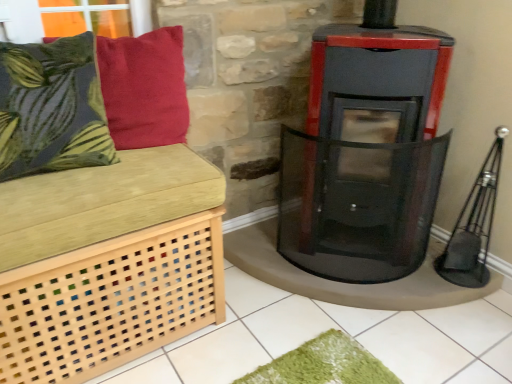
Question: Considering the relative positions of light wood lattice bench at left and green leafy fabric cushion at left, acting as the first pillow starting from the left, in the image provided, is light wood lattice bench at left to the left of green leafy fabric cushion at left, acting as the first pillow starting from the left, from the viewer's perspective?

Choices:
 (A) yes
 (B) no

Answer: (B)

Question: Is light wood lattice bench at left at the right side of green leafy fabric cushion at left, acting as the first pillow starting from the left?

Choices:
 (A) no
 (B) yes

Answer: (B)

Question: Is light wood lattice bench at left further to camera compared to green leafy fabric cushion at left, the 2th pillow viewed from the right?

Choices:
 (A) no
 (B) yes

Answer: (A)

Question: Is light wood lattice bench at left aimed at green leafy fabric cushion at left, the 2th pillow viewed from the right?

Choices:
 (A) yes
 (B) no

Answer: (B)

Question: From a real-world perspective, is light wood lattice bench at left positioned over green leafy fabric cushion at left, the 2th pillow viewed from the right, based on gravity?

Choices:
 (A) yes
 (B) no

Answer: (B)

Question: Considering the relative sizes of light wood lattice bench at left and green leafy fabric cushion at left, the 2th pillow viewed from the right, in the image provided, is light wood lattice bench at left bigger than green leafy fabric cushion at left, the 2th pillow viewed from the right,?

Choices:
 (A) no
 (B) yes

Answer: (B)

Question: Is black glass wood burning stove at center located outside light wood lattice bench at left?

Choices:
 (A) no
 (B) yes

Answer: (B)

Question: Is black glass wood burning stove at center not near light wood lattice bench at left?

Choices:
 (A) no
 (B) yes

Answer: (A)

Question: From a real-world perspective, is black glass wood burning stove at center below light wood lattice bench at left?

Choices:
 (A) no
 (B) yes

Answer: (A)

Question: From the image's perspective, is black glass wood burning stove at center on top of light wood lattice bench at left?

Choices:
 (A) yes
 (B) no

Answer: (A)

Question: Is light wood lattice bench at left at the back of black glass wood burning stove at center?

Choices:
 (A) no
 (B) yes

Answer: (A)

Question: Can you confirm if black glass wood burning stove at center is shorter than light wood lattice bench at left?

Choices:
 (A) yes
 (B) no

Answer: (B)

Question: Is green leafy fabric cushion at left, acting as the first pillow starting from the left, oriented away from velvety red pillow at upper left, which appears as the first pillow when viewed from the right?

Choices:
 (A) yes
 (B) no

Answer: (B)